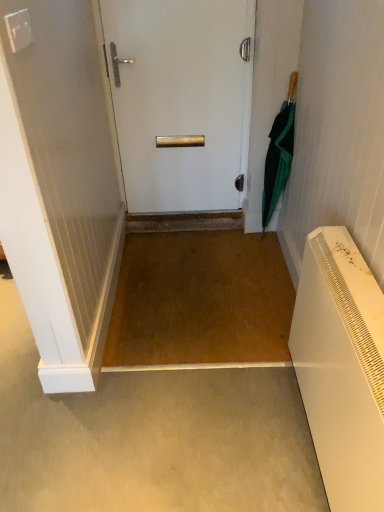
Question: From a real-world perspective, is green fabric umbrella at right under white matte door at center?

Choices:
 (A) no
 (B) yes

Answer: (B)

Question: Can we say green fabric umbrella at right lies outside white matte door at center?

Choices:
 (A) yes
 (B) no

Answer: (A)

Question: Can you confirm if green fabric umbrella at right is positioned to the left of white matte door at center?

Choices:
 (A) yes
 (B) no

Answer: (B)

Question: Is green fabric umbrella at right directly adjacent to white matte door at center?

Choices:
 (A) no
 (B) yes

Answer: (A)

Question: Considering the relative sizes of green fabric umbrella at right and white matte door at center in the image provided, is green fabric umbrella at right shorter than white matte door at center?

Choices:
 (A) no
 (B) yes

Answer: (B)

Question: Does green fabric umbrella at right lie behind white matte door at center?

Choices:
 (A) yes
 (B) no

Answer: (B)

Question: From a real-world perspective, is white matte door at center over green fabric umbrella at right?

Choices:
 (A) yes
 (B) no

Answer: (A)

Question: Is white matte door at center to the left of green fabric umbrella at right from the viewer's perspective?

Choices:
 (A) yes
 (B) no

Answer: (A)

Question: Is white matte door at center wider than green fabric umbrella at right?

Choices:
 (A) yes
 (B) no

Answer: (B)

Question: From the image's perspective, would you say white matte door at center is positioned over green fabric umbrella at right?

Choices:
 (A) no
 (B) yes

Answer: (B)

Question: Is white matte door at center not near green fabric umbrella at right?

Choices:
 (A) no
 (B) yes

Answer: (A)

Question: Can you confirm if white matte door at center is shorter than green fabric umbrella at right?

Choices:
 (A) no
 (B) yes

Answer: (A)

Question: From the image's perspective, is white matte door at center located above or below green fabric umbrella at right?

Choices:
 (A) below
 (B) above

Answer: (B)